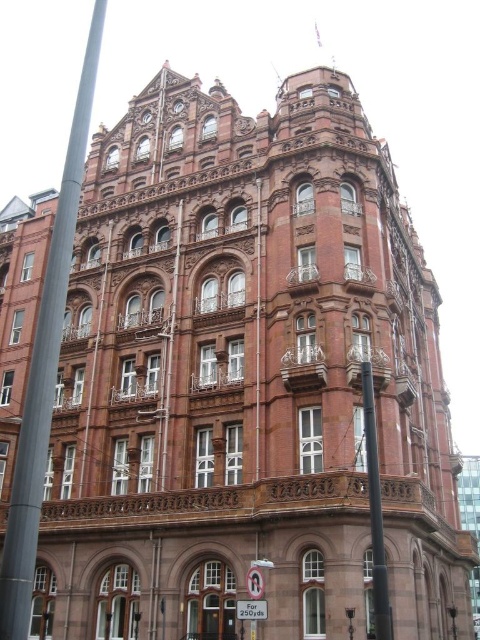
Question: Is white plastic sign at lower center to the right of metallic silver lamp post at lower right from the viewer's perspective?

Choices:
 (A) no
 (B) yes

Answer: (A)

Question: Estimate the real-world distances between objects in this image. Which object is farther from the metallic silver lamp post at lower right?

Choices:
 (A) white plastic sign at lower center
 (B) metallic pole at left

Answer: (B)

Question: Does metallic pole at left come behind metallic silver lamp post at lower right?

Choices:
 (A) no
 (B) yes

Answer: (A)

Question: Estimate the real-world distances between objects in this image. Which object is closer to the smooth black pole at center?

Choices:
 (A) metallic silver lamp post at lower right
 (B) white plastic sign at lower center
 (C) metallic pole at left

Answer: (B)

Question: Is white plastic sign at lower center positioned in front of metallic silver lamp post at lower right?

Choices:
 (A) no
 (B) yes

Answer: (B)

Question: Which of these objects is positioned closest to the polished metal lamp post at center?

Choices:
 (A) white plastic sign at lower center
 (B) metallic silver lamp post at lower right

Answer: (B)